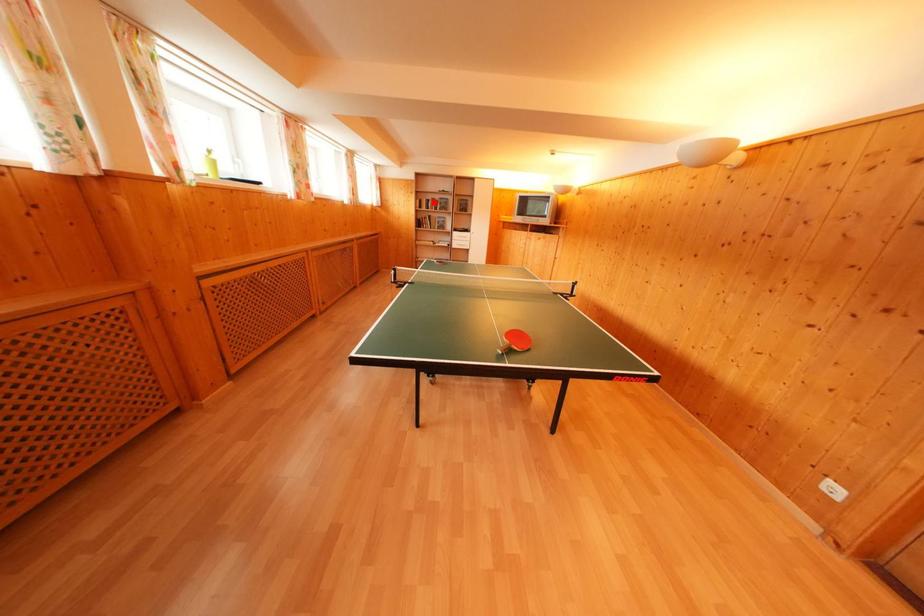
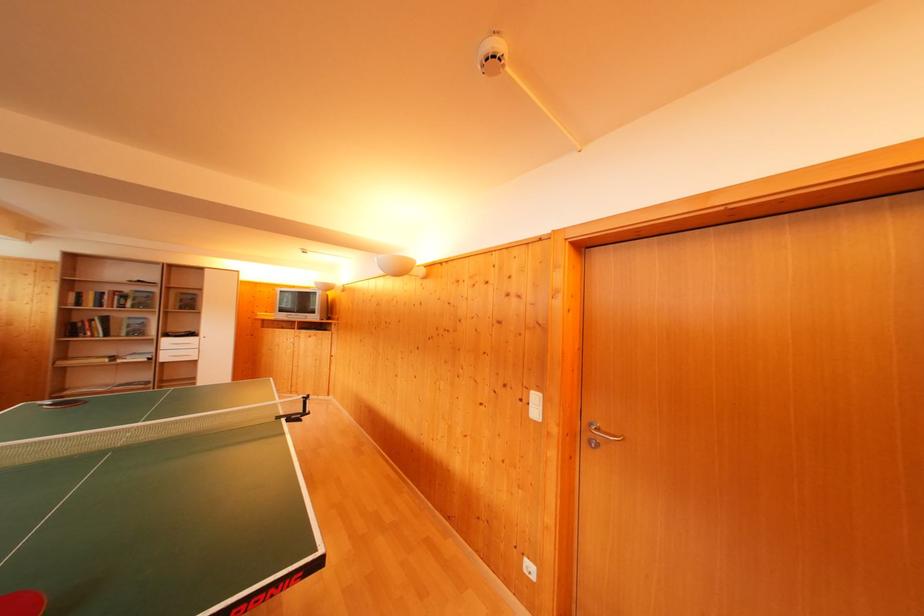
Question: I am providing you with two images of the same scene from different viewpoints. A red point is shown in image1. For the corresponding object point in image2, is it positioned nearer or farther from the camera?

Choices:
 (A) Nearer
 (B) Farther

Answer: (B)